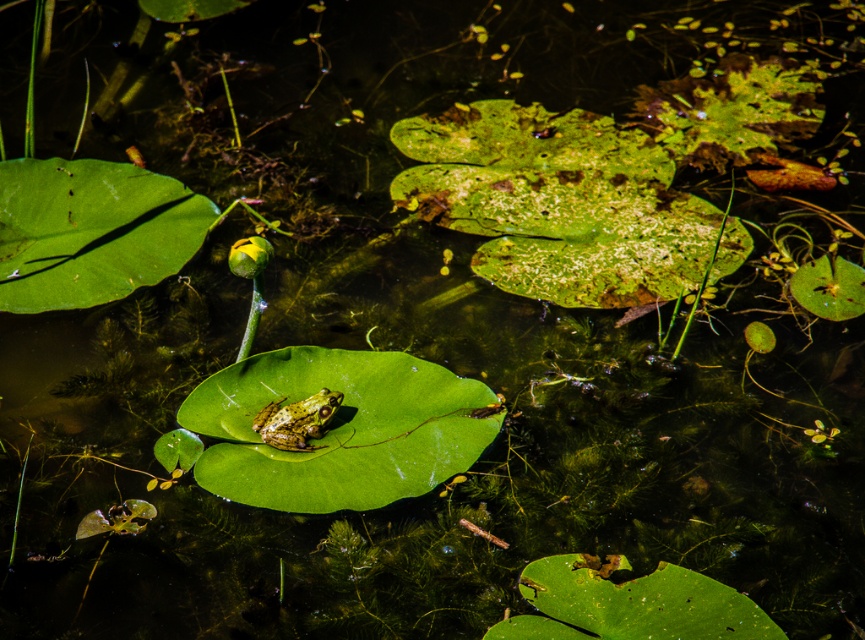
You are standing at the edge of the pond and want to locate two points in the scene. The first point, point (207, 388), and the second point, point (328, 392). Which point is closer to you?

Point (207, 388) is closer to you because it is further to the viewer than point (328, 392).

You are standing at the point marked as point [405,388]. You want to jump to the frog perched on the lily pad. Do you think you can reach the frog in one jump if your maximum jump distance is 7 feet?

The distance between you and the frog is 7.82 feet, which is greater than your maximum jump distance of 7 feet. Therefore, you cannot reach the frog in one jump.

You are a photographer trying to capture the speckled green frog at center and the green matte leaf at center in the same frame. Based on their positions, which object should you adjust your camera focus to first to ensure both are in the frame?

The green matte leaf at center is to the right of the speckled green frog at center. Since they are both at the center, adjusting focus on either would likely keep both in frame, but focusing on the frog first ensures the main subject is clear before adjusting for the leaf.